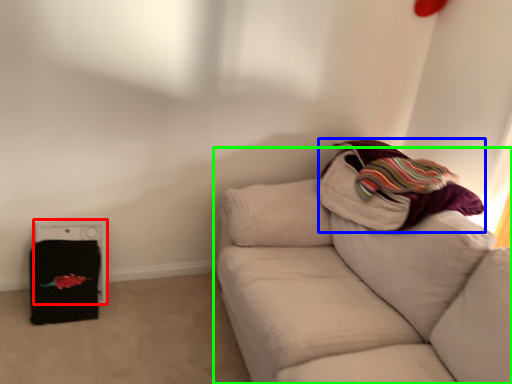
Question: Which is farther away from appliance (highlighted by a red box)? blanket (highlighted by a blue box) or studio couch (highlighted by a green box)?

Choices:
 (A) blanket
 (B) studio couch

Answer: (A)